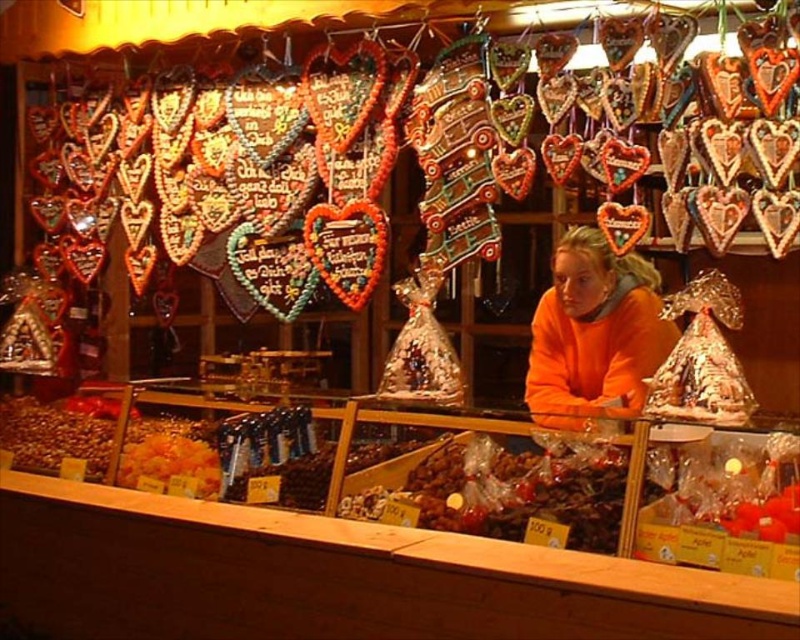
Between point (682, 548) and point (660, 348), which one is positioned behind?

Point (660, 348)

Identify the location of translucent plastic candy at center. This screenshot has height=640, width=800. (588, 490).

You are a GUI agent. You are given a task and a screenshot of the screen. Output one action in this format:
    pyautogui.click(x=<x>, y=<y>)
    Task: Click on the translucent plastic candy at center
    
    Given the screenshot: What is the action you would take?
    [588, 490]